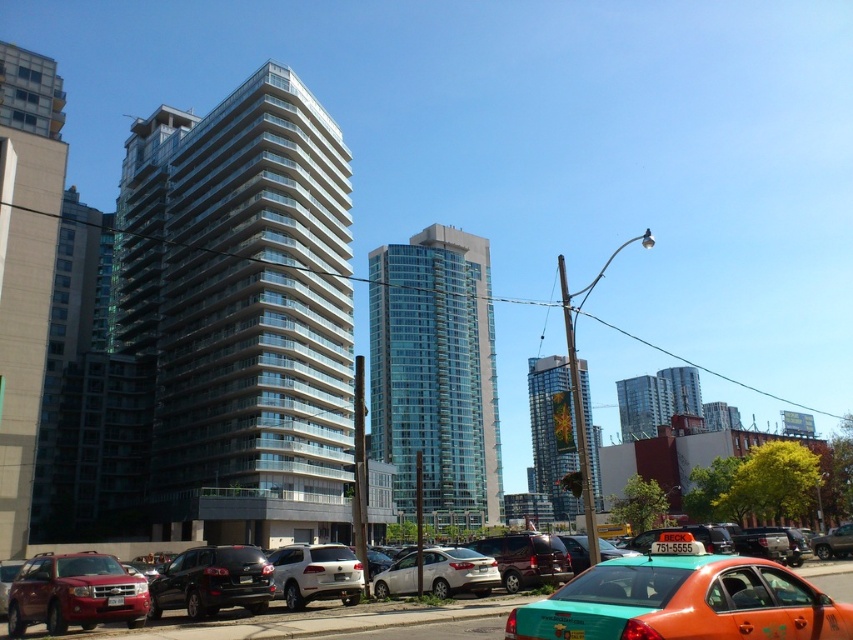
You are a delivery driver needing to park your vehicle in a tight space between two parked cars. You have a teal glossy taxi at lower right and a white matte suv at center. Which vehicle should you choose to fit better in the narrow space?

The teal glossy taxi at lower right is thinner than the white matte suv at center, so it would fit better in the narrow space.

You are a city planner assessing the urban layout. You need to determine which of the two buildings, the glassy concrete building at left or the glassy reflective skyscraper at center, has a narrower width. Based on the scene, which one is it?

The glassy concrete building at left is thinner than the glassy reflective skyscraper at center, so the glassy concrete building at left has a narrower width.

You are a drone operator tasked with flying a drone between the glassy concrete building at left and the white matte sedan at center. The drone has a maximum flight range of 60 meters. Can the drone safely fly between them without exceeding its range?

The distance between the glassy concrete building at left and the white matte sedan at center is 64.19 meters. Since the drone can only fly up to 60 meters, it cannot safely fly between them without exceeding its range.